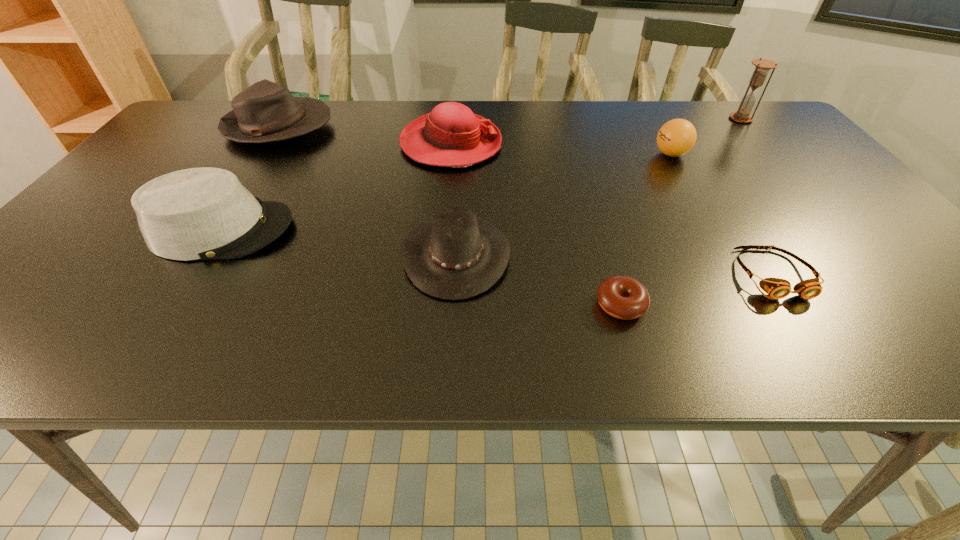
Locate an element on the screen. This screenshot has height=540, width=960. free spot located 0.060m on the front-facing side of the shortest hat is located at coordinates (539, 255).

Where is `vacant space located with the lenses facing forward on the goggles`? Image resolution: width=960 pixels, height=540 pixels. vacant space located with the lenses facing forward on the goggles is located at coordinates (819, 346).

Identify the location of free region located 0.250m on the left of the doughnut. (463, 305).

At what (x,y) coordinates should I click in order to perform the action: click on hourglass that is at the far edge. Please return your answer as a coordinate pair (x, y). Image resolution: width=960 pixels, height=540 pixels. Looking at the image, I should click on (762, 66).

The width and height of the screenshot is (960, 540). Identify the location of object situated at the near edge. (623, 297).

Find the location of `object located in the left edge section of the desktop`. object located in the left edge section of the desktop is located at coordinates (265, 112).

This screenshot has height=540, width=960. In order to click on object at the right edge in this screenshot , I will do (762, 66).

The height and width of the screenshot is (540, 960). Identify the location of object that is at the far left corner. (265, 112).

Where is `object that is at the far right corner`? object that is at the far right corner is located at coordinates (762, 66).

I want to click on free space at the far edge of the desktop, so click(539, 133).